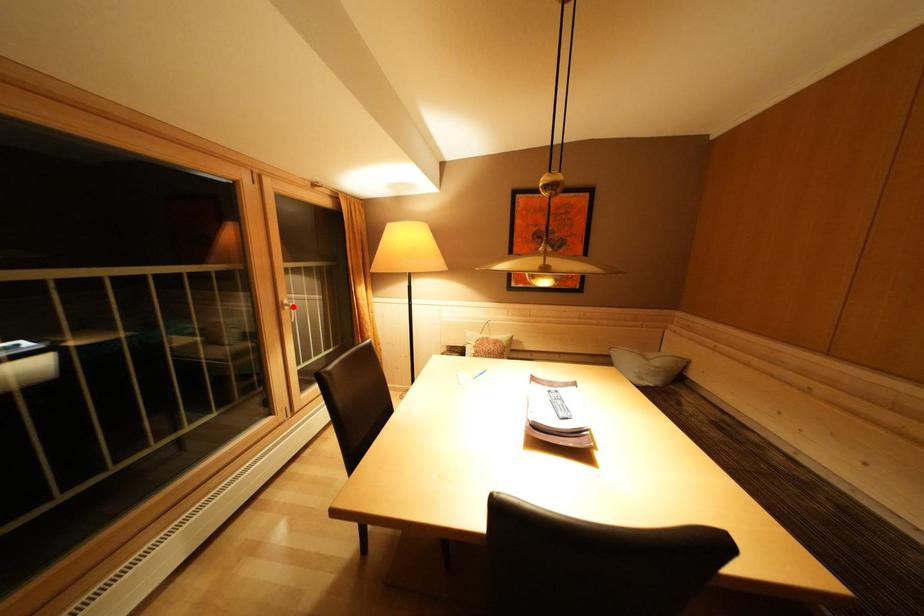
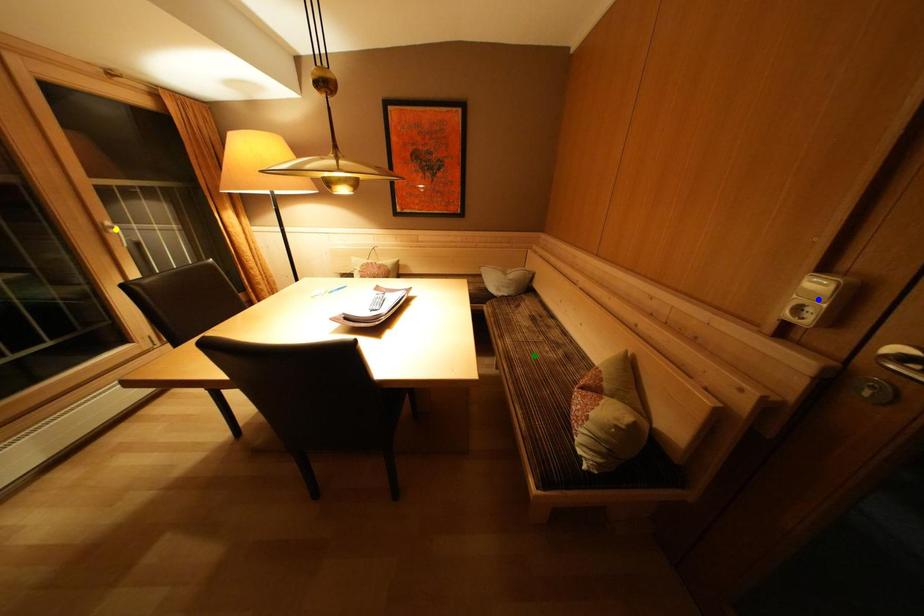
Question: I am providing you with two images of the same scene from different viewpoints. A red point is marked on the first image. You are given multiple points on the second image. Which point in image 2 is actually the same real-world point as the red point in image 1?

Choices:
 (A) yellow point
 (B) blue point
 (C) green point

Answer: (A)